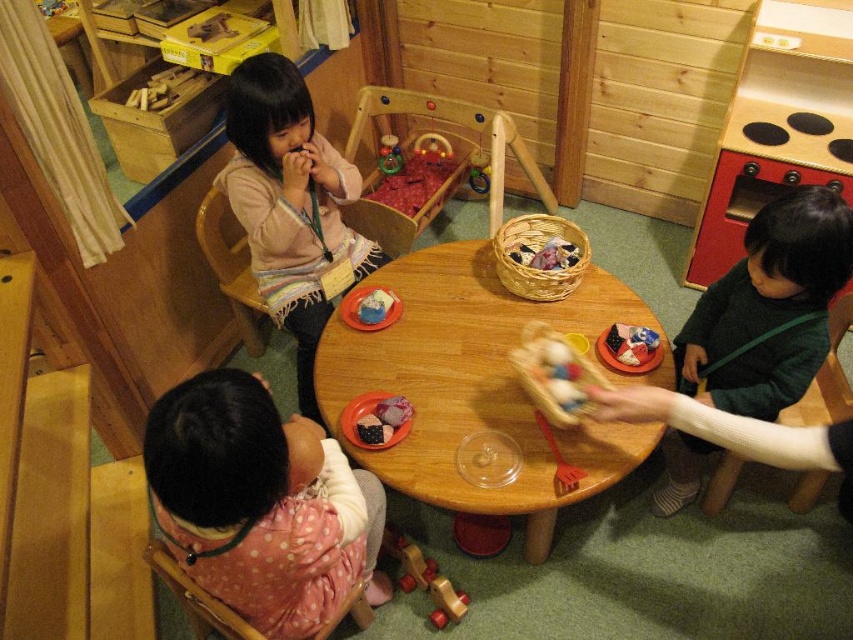
You are a parent trying to locate your child in a playroom. You remember your child was wearing either a pink polka dot dress at lower left or a matte pink sweater at upper left. Based on their positions, which child is closer to the round wooden table?

The pink polka dot dress at lower left is positioned under the matte pink sweater at upper left, so the child in the pink polka dot dress at lower left is closer to the round wooden table.